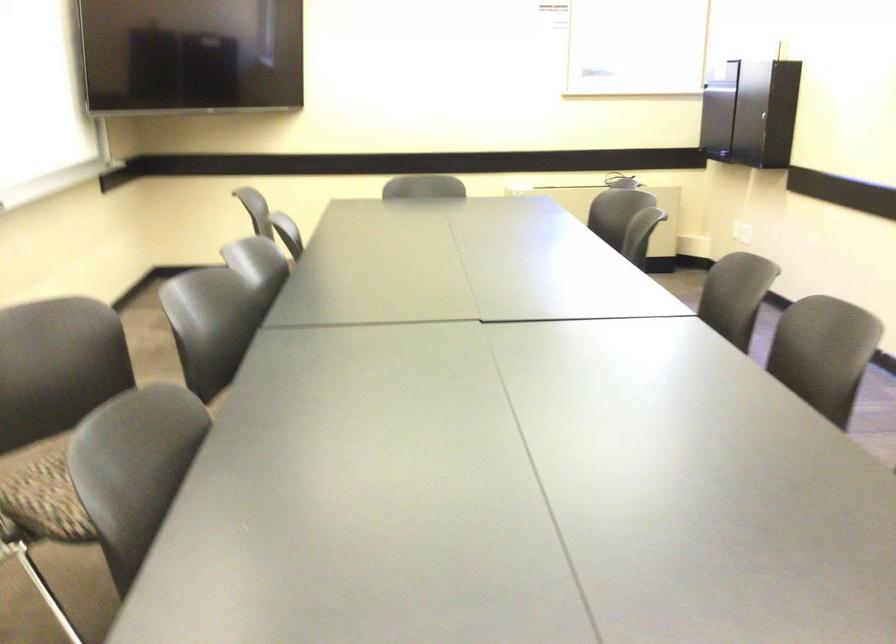
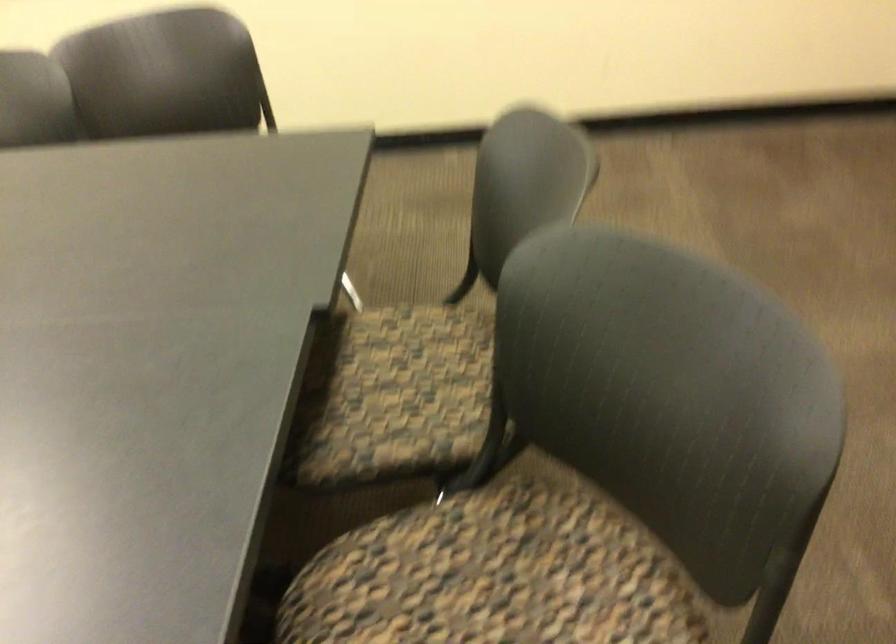
Based on the continuous images, in which direction is the camera rotating?

The camera rotated toward right-down.